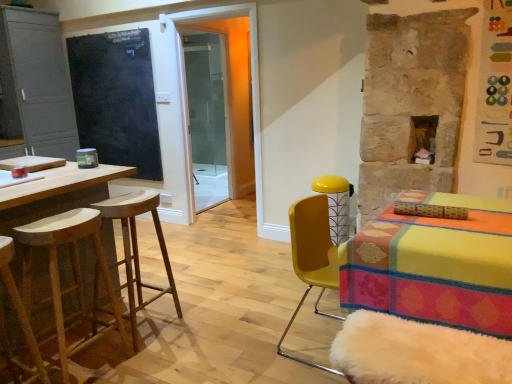
Question: Does transparent glass shower door at center appear on the right side of natural wood stool at left, the second stool viewed from the front?

Choices:
 (A) yes
 (B) no

Answer: (A)

Question: Is transparent glass shower door at center positioned beyond the bounds of natural wood stool at left, the second stool viewed from the front?

Choices:
 (A) no
 (B) yes

Answer: (B)

Question: From a real-world perspective, is transparent glass shower door at center on top of natural wood stool at left, the second stool viewed from the front?

Choices:
 (A) no
 (B) yes

Answer: (B)

Question: From the image's perspective, is transparent glass shower door at center beneath natural wood stool at left, the second stool from the back?

Choices:
 (A) no
 (B) yes

Answer: (A)

Question: Is transparent glass shower door at center to the left of natural wood stool at left, the second stool from the back, from the viewer's perspective?

Choices:
 (A) no
 (B) yes

Answer: (A)

Question: Considering the positions of natural wood stool at left, the second stool viewed from the front, and wooden stool at left, which is the first stool from front to back, in the image, is natural wood stool at left, the second stool viewed from the front, bigger or smaller than wooden stool at left, which is the first stool from front to back,?

Choices:
 (A) big
 (B) small

Answer: (A)

Question: Is natural wood stool at left, the second stool from the back, to the left or to the right of wooden stool at left, which is counted as the third stool, starting from the back, in the image?

Choices:
 (A) left
 (B) right

Answer: (B)

Question: Is natural wood stool at left, the second stool viewed from the front, spatially inside wooden stool at left, which is the first stool from front to back, or outside of it?

Choices:
 (A) inside
 (B) outside

Answer: (B)

Question: From a real-world perspective, is natural wood stool at left, the second stool viewed from the front, physically located above or below wooden stool at left, which is the first stool from front to back?

Choices:
 (A) above
 (B) below

Answer: (A)

Question: In terms of width, does wooden stool at left, which is counted as the third stool, starting from the back, look wider or thinner when compared to natural wood stool at left, the second stool viewed from the front?

Choices:
 (A) wide
 (B) thin

Answer: (A)

Question: Does point (16, 292) appear closer or farther from the camera than point (24, 284)?

Choices:
 (A) farther
 (B) closer

Answer: (B)

Question: Choose the correct answer: Is wooden stool at left, which is counted as the third stool, starting from the back, inside natural wood stool at left, the second stool viewed from the front, or outside it?

Choices:
 (A) inside
 (B) outside

Answer: (B)

Question: In the image, is wooden stool at left, which is counted as the third stool, starting from the back, positioned in front of or behind natural wood stool at left, the second stool from the back?

Choices:
 (A) behind
 (B) front

Answer: (B)

Question: From the image's perspective, is natural wood stool at left, the second stool viewed from the front, located above or below matte gray cabinet at left?

Choices:
 (A) below
 (B) above

Answer: (A)

Question: In terms of height, does natural wood stool at left, the second stool from the back, look taller or shorter compared to matte gray cabinet at left?

Choices:
 (A) short
 (B) tall

Answer: (A)